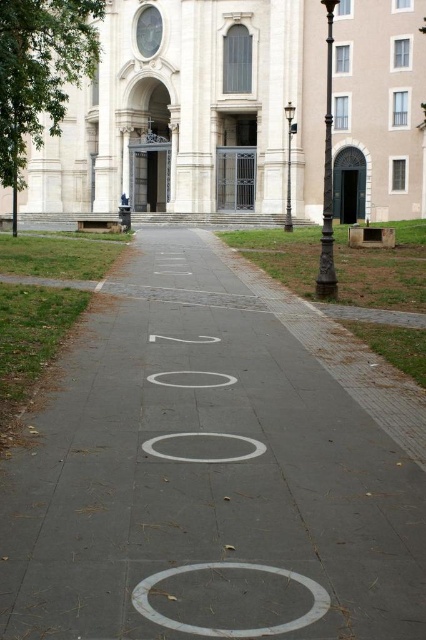
Can you confirm if white concrete pavement at center is smaller than white matte circle at center?

Incorrect, white concrete pavement at center is not smaller in size than white matte circle at center.

Between point (310, 540) and point (172, 433), which one is positioned behind?

Point (172, 433)

Who is more distant from viewer, (252, 630) or (164, 436)?

The point (164, 436) is behind.

Where is `white concrete pavement at center`? This screenshot has width=426, height=640. white concrete pavement at center is located at coordinates (215, 470).

Which is more to the right, white concrete circle at center or white smooth circle at center?

Positioned to the right is white concrete circle at center.

What do you see at coordinates (230, 628) in the screenshot?
I see `white concrete circle at center` at bounding box center [230, 628].

The image size is (426, 640). What are the coordinates of `white concrete circle at center` in the screenshot? It's located at (230, 628).

Does white concrete pavement at center appear on the left side of white smooth circle at center?

In fact, white concrete pavement at center is to the right of white smooth circle at center.

Is white concrete pavement at center positioned at the back of white smooth circle at center?

No, white concrete pavement at center is in front of white smooth circle at center.

Who is more forward, (65, 387) or (184, 374)?

Point (65, 387)

Locate an element on the screen. The height and width of the screenshot is (640, 426). white concrete pavement at center is located at coordinates point(215,470).